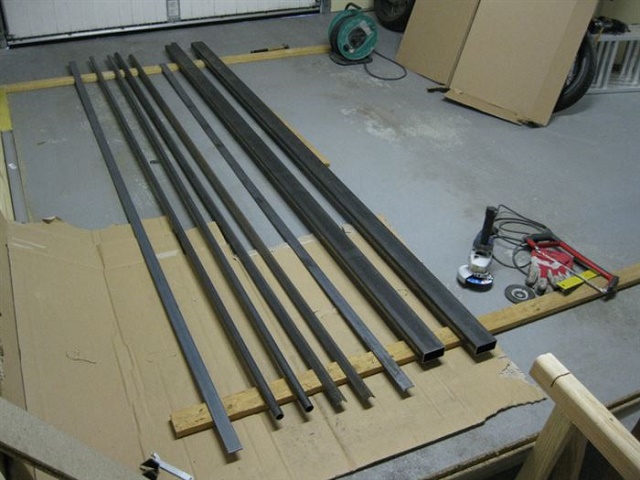
Locate an element on the screen. The image size is (640, 480). black cable on spool is located at coordinates (335, 23).